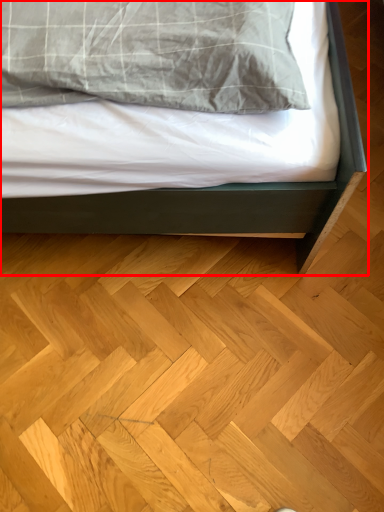
Question: In this image, where is bed (annotated by the red box) located relative to hardwood?

Choices:
 (A) right
 (B) left

Answer: (B)